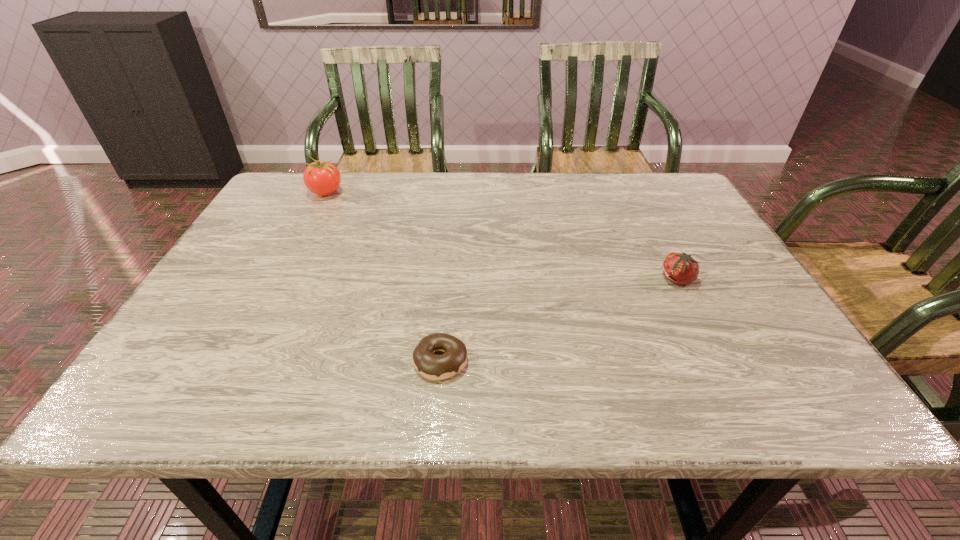
Locate an element on the screen. This screenshot has height=540, width=960. object that is at the near edge is located at coordinates (433, 367).

Locate an element on the screen. This screenshot has width=960, height=540. object at the left edge is located at coordinates (322, 178).

I want to click on object that is at the right edge, so click(680, 268).

Identify the location of object that is at the far left corner. (322, 178).

In the image, there is a desktop. Where is `vacant space at the far edge`? vacant space at the far edge is located at coordinates (483, 181).

Locate an element on the screen. This screenshot has height=540, width=960. vacant area at the near edge is located at coordinates (603, 381).

The width and height of the screenshot is (960, 540). In order to click on vacant area at the left edge in this screenshot , I will do `click(251, 259)`.

In the image, there is a desktop. Where is `free space at the right edge`? This screenshot has width=960, height=540. free space at the right edge is located at coordinates (781, 349).

At what (x,y) coordinates should I click in order to perform the action: click on vacant space at the far left corner. Please return your answer as a coordinate pair (x, y). Looking at the image, I should click on (267, 204).

Image resolution: width=960 pixels, height=540 pixels. In order to click on vacant space at the far right corner of the desktop in this screenshot , I will do `click(670, 215)`.